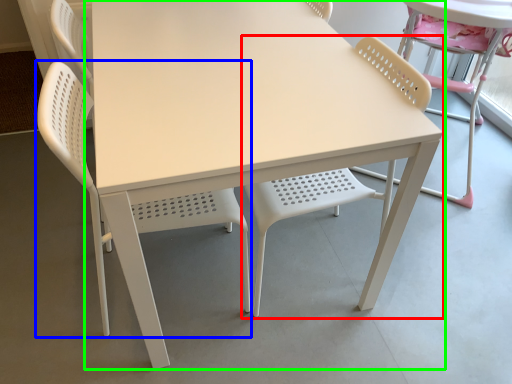
Question: Considering the real-world distances, which object is farthest from chair (highlighted by a red box)? chair (highlighted by a blue box) or table (highlighted by a green box)?

Choices:
 (A) chair
 (B) table

Answer: (B)